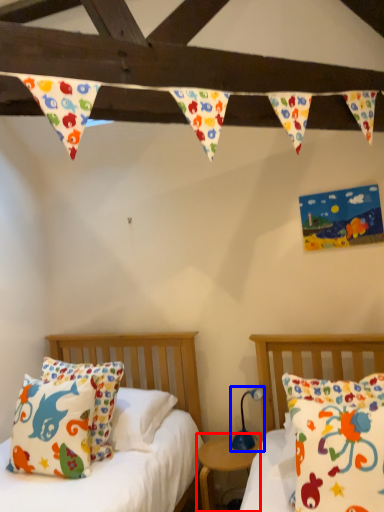
Question: Among these objects, which one is farthest to the camera, nightstand (highlighted by a red box) or lamp (highlighted by a blue box)?

Choices:
 (A) nightstand
 (B) lamp

Answer: (B)